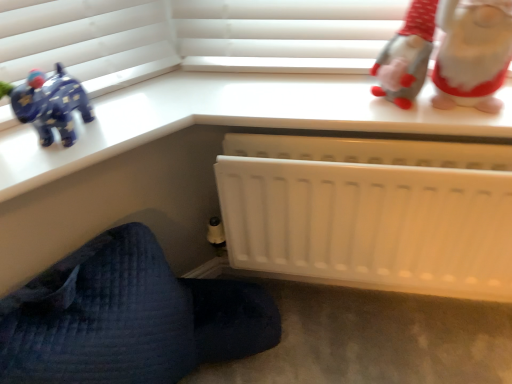
At what (x,y) coordinates should I click in order to perform the action: click on empty space that is ontop of white plastic radiator at lower center. Please return your answer as a coordinate pair (x, y). The height and width of the screenshot is (384, 512). Looking at the image, I should click on (379, 142).